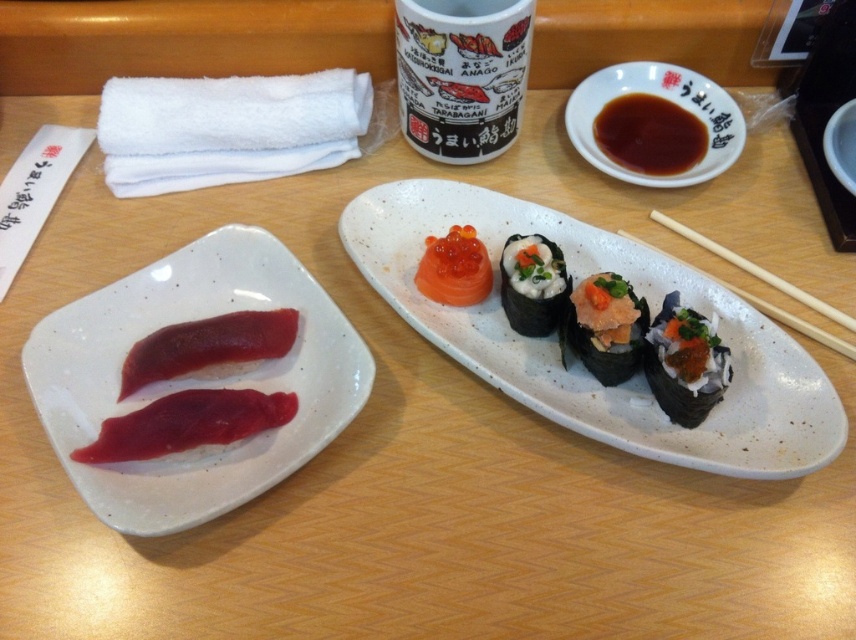
Which is below, pink raw fish at left or wooden chopsticks at right?

Positioned lower is pink raw fish at left.

What do you see at coordinates (207, 346) in the screenshot? I see `pink raw fish at left` at bounding box center [207, 346].

Where is `pink raw fish at left`? pink raw fish at left is located at coordinates (207, 346).

From the picture: Does shiny black sushi at center appear over shiny brown sauce at upper right?

Actually, shiny black sushi at center is below shiny brown sauce at upper right.

Can you confirm if shiny black sushi at center is taller than shiny brown sauce at upper right?

In fact, shiny black sushi at center may be shorter than shiny brown sauce at upper right.

Which is behind, point (660, 404) or point (651, 113)?

Point (651, 113)

Image resolution: width=856 pixels, height=640 pixels. What are the coordinates of `shiny black sushi at center` in the screenshot? It's located at (685, 362).

Between point (515, 243) and point (791, 323), which one is positioned in front?

Point (515, 243)

Does white rice ball at center have a greater width compared to wooden chopsticks at right?

Incorrect, white rice ball at center's width does not surpass wooden chopsticks at right's.

What do you see at coordinates (533, 284) in the screenshot? I see `white rice ball at center` at bounding box center [533, 284].

The height and width of the screenshot is (640, 856). Identify the location of white rice ball at center. (533, 284).